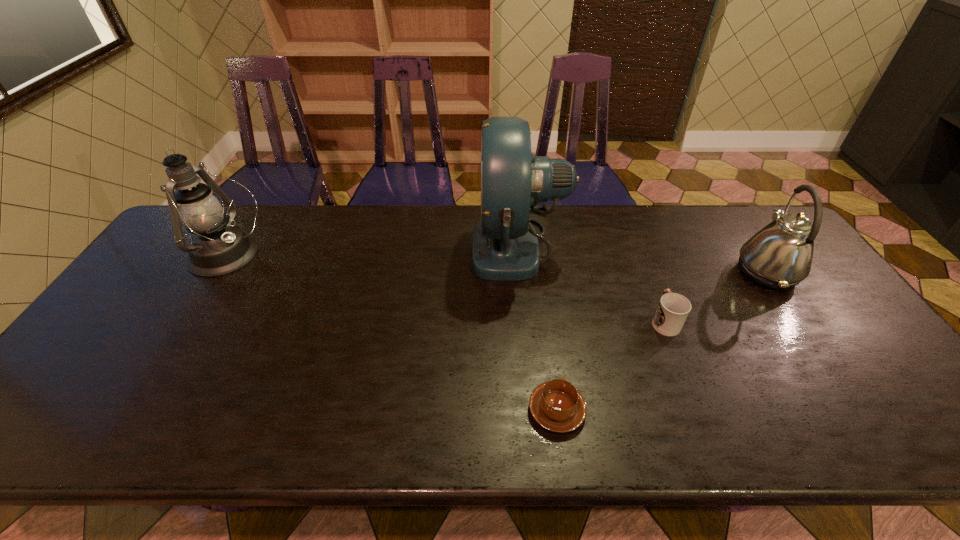
Find the location of a particular element. vacant space located in front of the tallest object to blow air is located at coordinates (371, 247).

You are a GUI agent. You are given a task and a screenshot of the screen. Output one action in this format:
    pyautogui.click(x=<x>, y=<y>)
    Task: Click on the free region located in front of the tallest object to blow air
    
    Given the screenshot: What is the action you would take?
    pyautogui.click(x=355, y=247)

You are a GUI agent. You are given a task and a screenshot of the screen. Output one action in this format:
    pyautogui.click(x=<x>, y=<y>)
    Task: Click on the free spot located on the back of the leftmost object
    The height and width of the screenshot is (540, 960).
    Given the screenshot: What is the action you would take?
    pyautogui.click(x=251, y=219)

This screenshot has width=960, height=540. Find the location of `vacant area located on the back of the third shortest object`. vacant area located on the back of the third shortest object is located at coordinates (738, 231).

The height and width of the screenshot is (540, 960). In order to click on vacant region located 0.250m on the side of the second shortest object where the handle is located in this screenshot , I will do `click(636, 247)`.

At what (x,y) coordinates should I click in order to perform the action: click on free space located on the side of the second shortest object where the handle is located. Please return your answer as a coordinate pair (x, y). Image resolution: width=960 pixels, height=540 pixels. Looking at the image, I should click on coord(649,281).

At what (x,y) coordinates should I click in order to perform the action: click on free location located on the side of the second shortest object where the handle is located. Please return your answer as a coordinate pair (x, y). Looking at the image, I should click on (625, 221).

At what (x,y) coordinates should I click in order to perform the action: click on free region located 0.110m on the side of the shortest object with the handle. Please return your answer as a coordinate pair (x, y). Looking at the image, I should click on (548, 348).

Image resolution: width=960 pixels, height=540 pixels. In order to click on vacant space situated 0.330m on the side of the shortest object with the handle in this screenshot , I will do `click(540, 286)`.

In order to click on vacant space located on the side of the shortest object with the handle in this screenshot , I will do `click(543, 309)`.